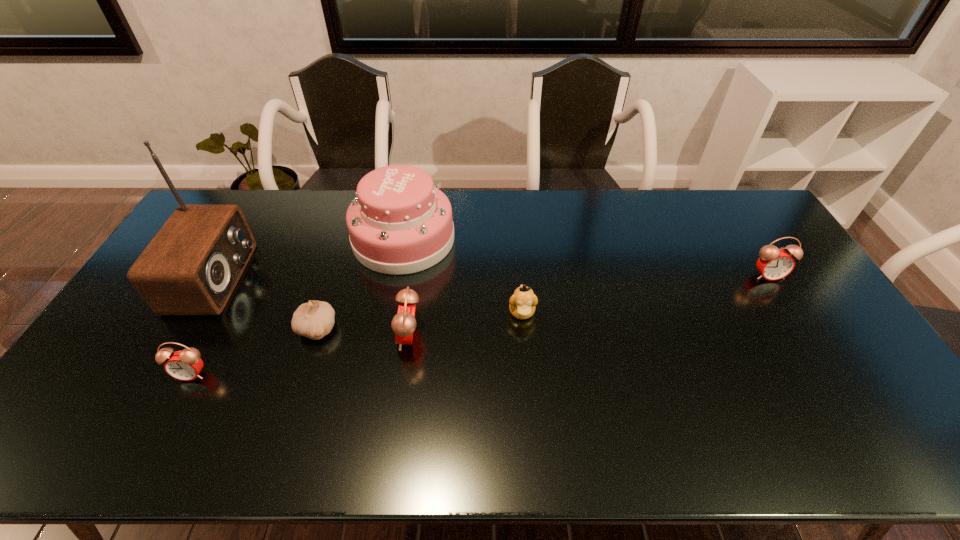
To make them evenly spaced by inserting another alarm_clock among them, please locate a vacant spot for this new alarm_clock. Please provide its 2D coordinates. Your answer should be formatted as a tuple, i.e. [(x, y)], where the tuple contains the x and y coordinates of a point satisfying the conditions above.

[(600, 304)]